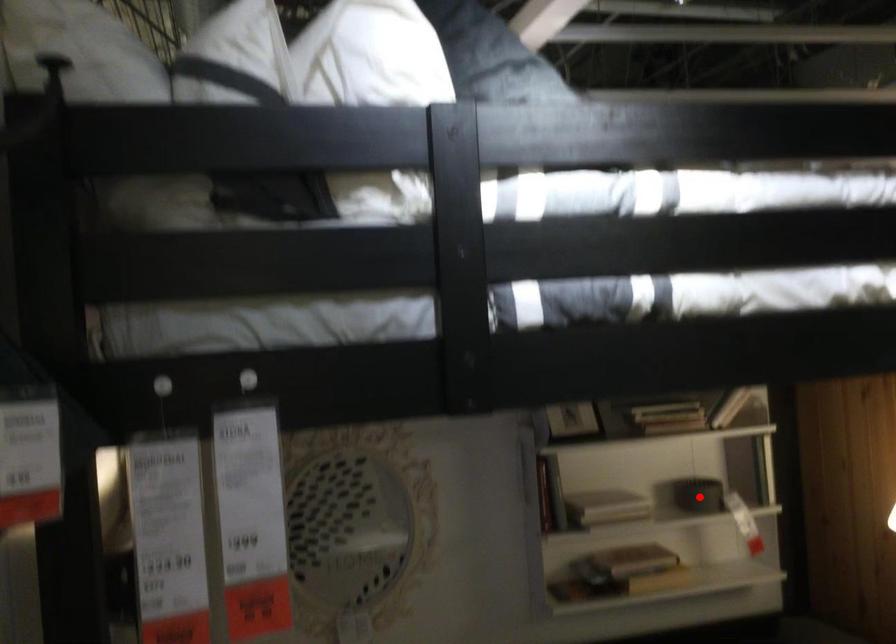
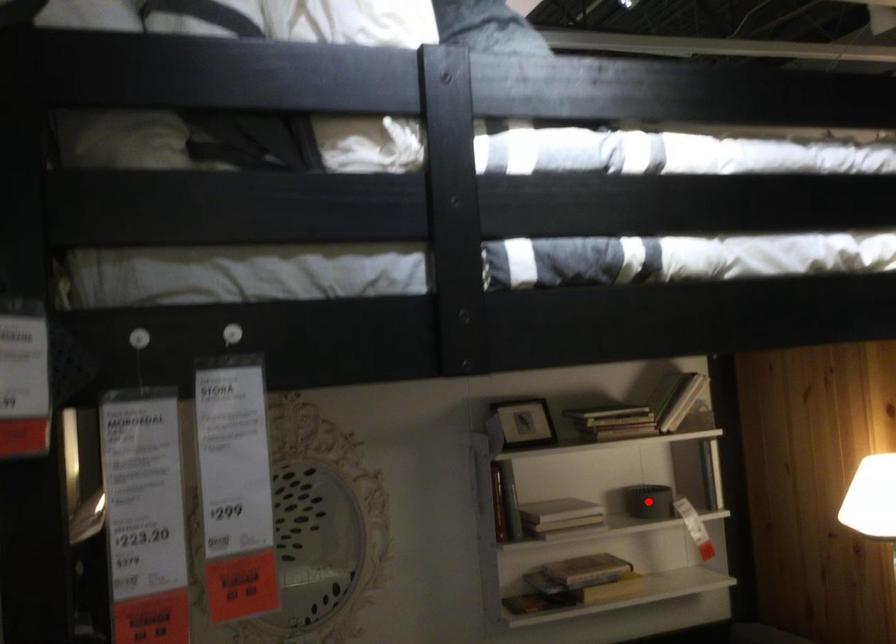
I am providing you with two images of the same scene from different viewpoints. A red point is marked on the first image and another point is marked on the second image. Does the point marked in image1 correspond to the same location as the one in image2?

Yes